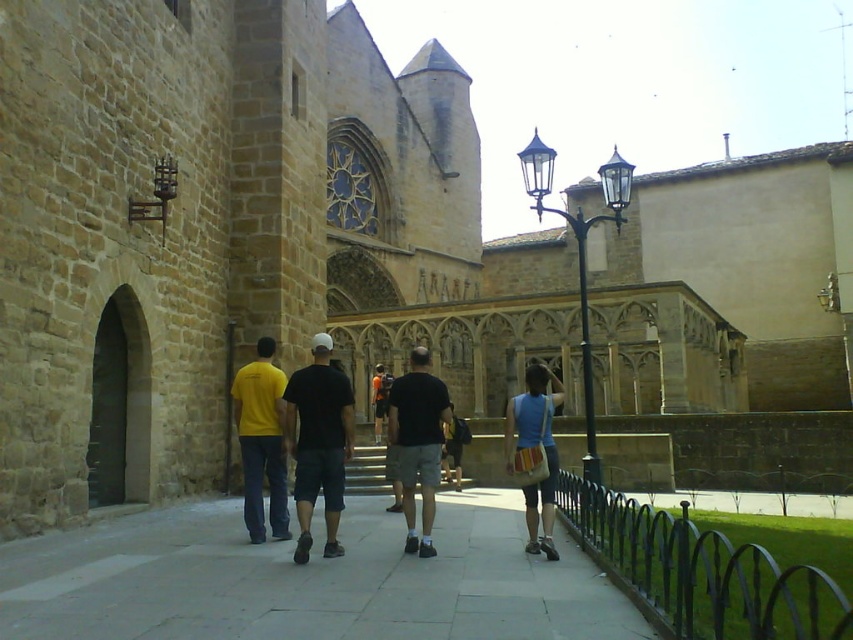
Question: In this image, where is black cotton t-shirt at center located relative to blue cotton tank top at center?

Choices:
 (A) left
 (B) right

Answer: (A)

Question: Considering the relative positions of gray concrete pavement at center and black cotton t-shirt at center in the image provided, where is gray concrete pavement at center located with respect to black cotton t-shirt at center?

Choices:
 (A) above
 (B) below

Answer: (B)

Question: Does gray concrete pavement at center lie behind black cotton t-shirt at center?

Choices:
 (A) no
 (B) yes

Answer: (A)

Question: Among these points, which one is farthest from the camera?

Choices:
 (A) (540, 365)
 (B) (404, 550)
 (C) (281, 433)
 (D) (339, 371)

Answer: (D)

Question: Which object is farther from the camera taking this photo?

Choices:
 (A) black cotton t-shirt at center
 (B) yellow t-shirt at center

Answer: (B)

Question: Among these objects, which one is nearest to the camera?

Choices:
 (A) black cotton shorts at center
 (B) gray concrete pavement at center

Answer: (B)